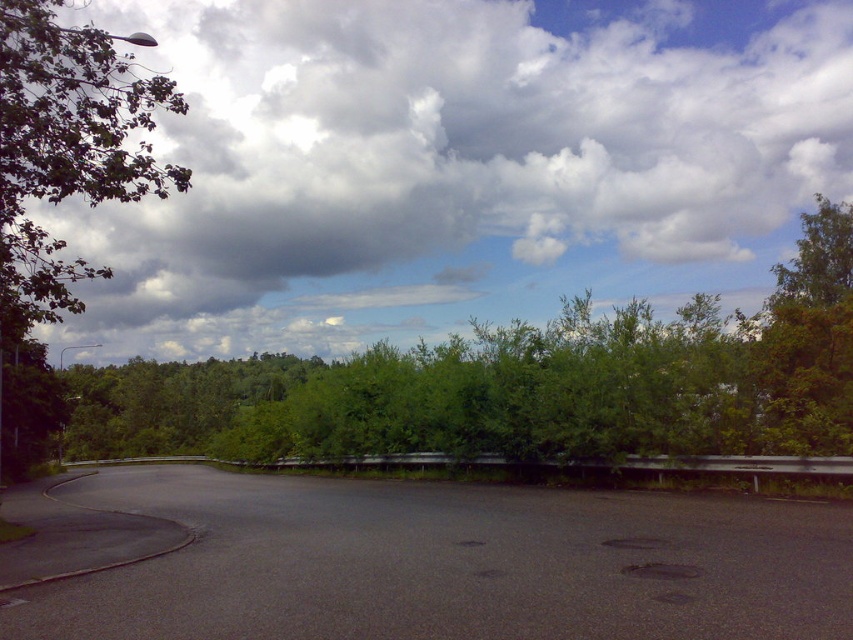
Question: Estimate the real-world distances between objects in this image. Which object is closer to the green leafy tree at upper right?

Choices:
 (A) green leafy tree at left
 (B) black asphalt highway at center
 (C) cloudy sky at upper center
 (D) green leafy tree at center

Answer: (B)

Question: Which point is farther from the camera taking this photo?

Choices:
 (A) (45, 20)
 (B) (840, 308)

Answer: (B)

Question: Based on their relative distances, which object is farther from the black asphalt highway at center?

Choices:
 (A) green leafy tree at left
 (B) green leafy tree at center
 (C) cloudy sky at upper center
 (D) green leafy tree at upper right

Answer: (C)

Question: Is black asphalt highway at center smaller than green leafy tree at center?

Choices:
 (A) yes
 (B) no

Answer: (A)

Question: Does cloudy sky at upper center lie behind black asphalt highway at center?

Choices:
 (A) no
 (B) yes

Answer: (B)

Question: From the image, what is the correct spatial relationship of cloudy sky at upper center in relation to black asphalt highway at center?

Choices:
 (A) left
 (B) right

Answer: (B)